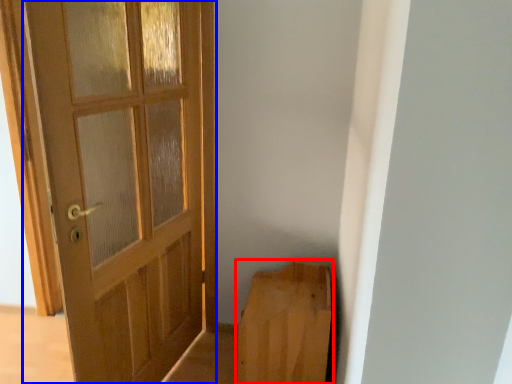
Question: Which of the following is the farthest to the observer, furniture (highlighted by a red box) or door (highlighted by a blue box)?

Choices:
 (A) furniture
 (B) door

Answer: (A)